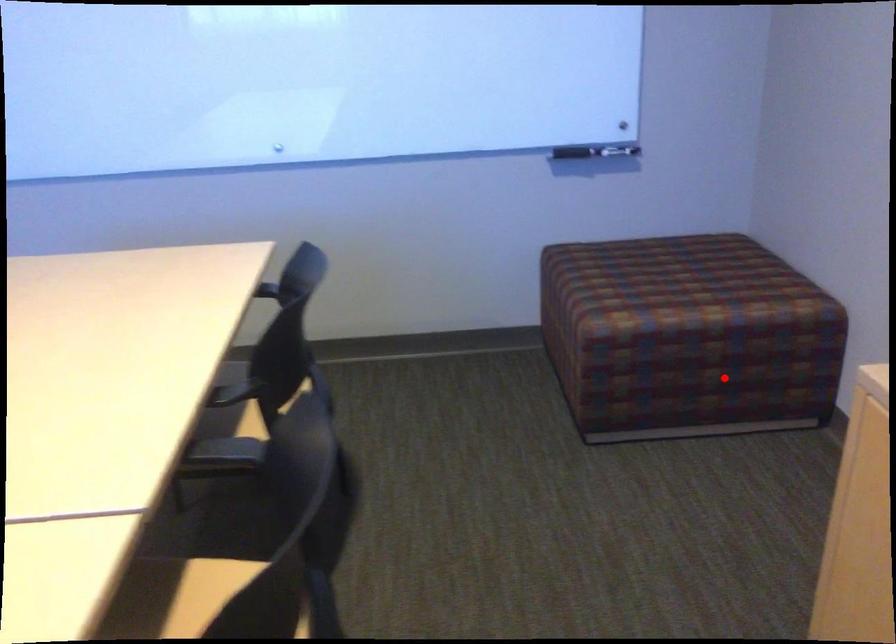
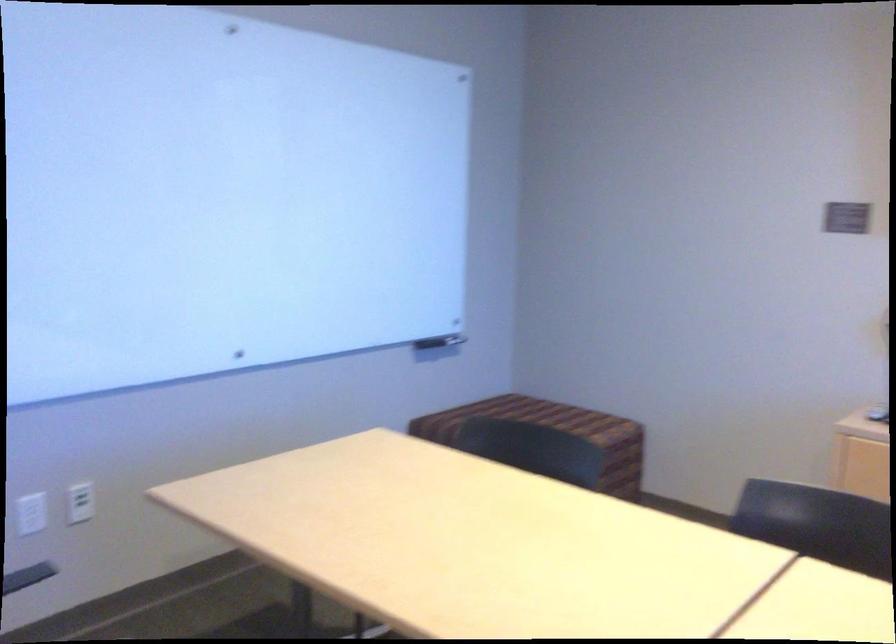
Locate, in the second image, the point that corresponds to the highlighted location in the first image.

(607, 482)